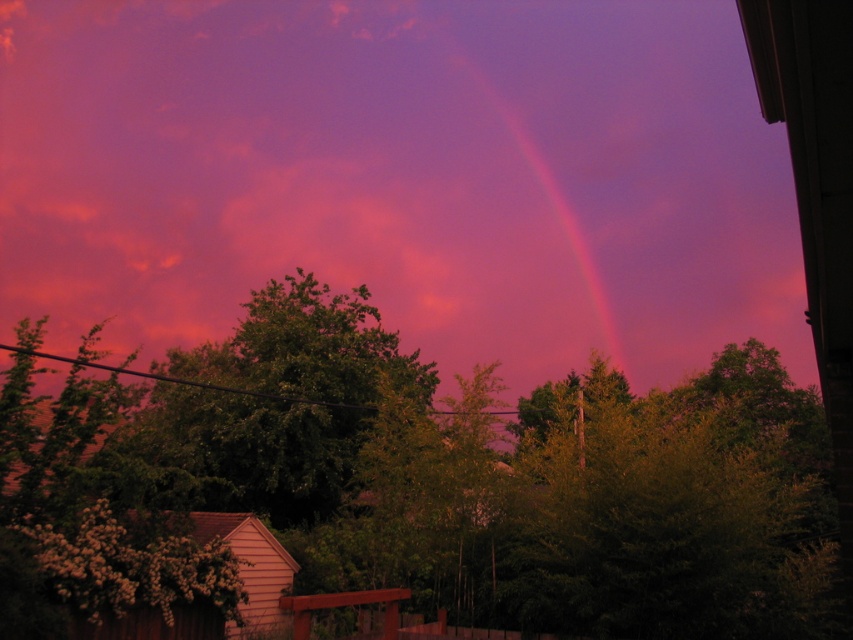
You are an artist trying to paint the sunset scene. You notice both the pink translucent cloud at upper center and the rainbow at upper center in the sky. Which one should you paint first to ensure proper layering?

You should paint the rainbow at upper center first because the pink translucent cloud at upper center might be wider than the rainbow at upper center, meaning the cloud could partially cover parts of the rainbow. Painting the rainbow first allows you to then paint the cloud over it, maintaining the correct overlapping layers.

You are an artist trying to paint the sunset scene. You notice both the pink translucent cloud at upper center and the rainbow at upper center. Which object should you paint first if you want to depict them overlapping correctly?

You should paint the rainbow at upper center first because the pink translucent cloud at upper center is larger and would overlap it.